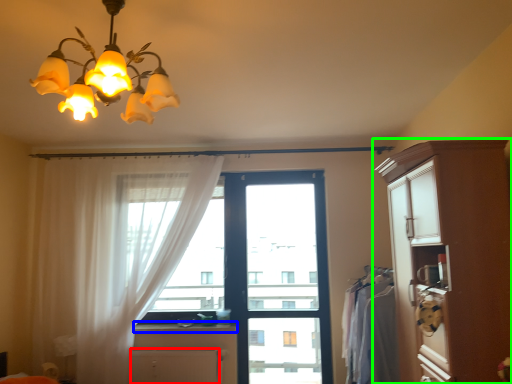
Question: Considering the real-world distances, which object is closest to cabinetry (highlighted by a red box)? counter top (highlighted by a blue box) or cabinetry (highlighted by a green box).

Choices:
 (A) counter top
 (B) cabinetry

Answer: (A)